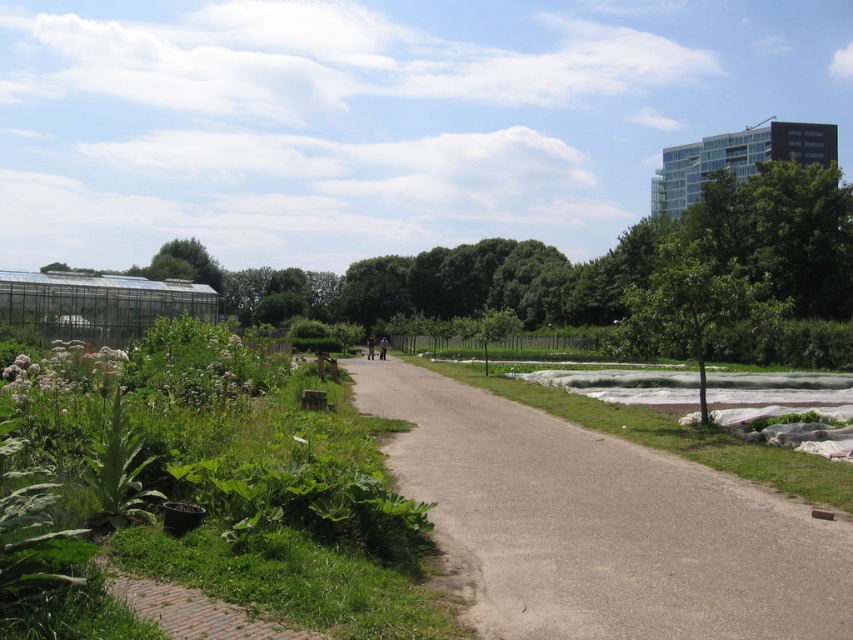
You are standing at the starting point of the pathway in the park and see two points marked on the path. The first point is at coordinates point (460, 496) and the second point is at point (735, 276). If you walk straight along the path, which point will you encounter first?

Point (460, 496) is in front of point (735, 276), so you will encounter point (460, 496) first along the path.